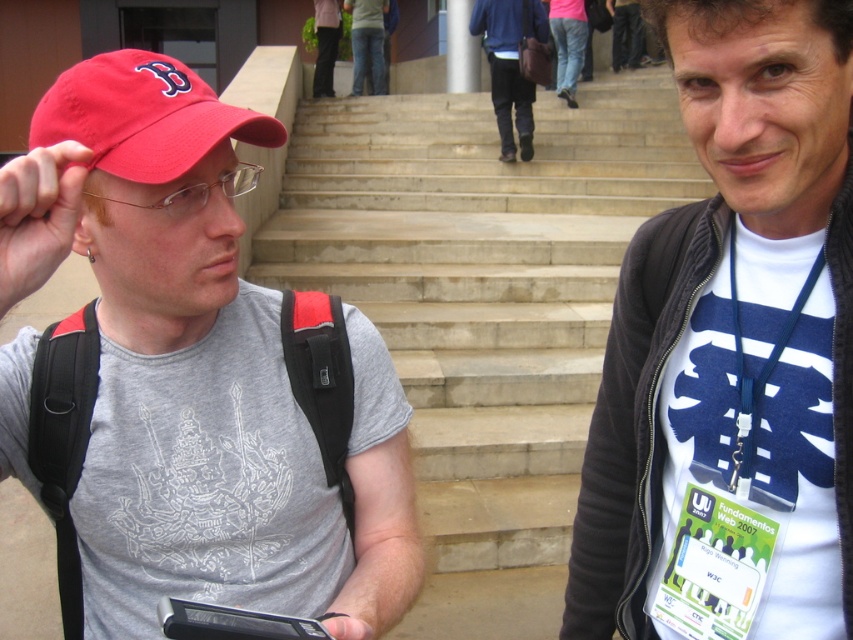
The image size is (853, 640). Identify the location of dark blue jeans at center. (509, 65).

Which is more to the left, dark blue jeans at center or black plastic smartphone at lower left?

Positioned to the left is black plastic smartphone at lower left.

Between point (469, 20) and point (248, 614), which one is positioned behind?

Positioned behind is point (469, 20).

I want to click on dark blue jeans at center, so click(509, 65).

Consider the image. Is white matte t-shirt at center thinner than matte red cap at upper left?

Correct, white matte t-shirt at center's width is less than matte red cap at upper left's.

Is white matte t-shirt at center above matte red cap at upper left?

Actually, white matte t-shirt at center is below matte red cap at upper left.

Between point (767, 324) and point (410, 528), which one is positioned behind?

Positioned behind is point (410, 528).

The image size is (853, 640). I want to click on white matte t-shirt at center, so click(x=732, y=352).

Is point (828, 337) closer to camera compared to point (495, 76)?

Yes.

Measure the distance between point (x=799, y=26) and camera.

They are 37.14 inches apart.

Image resolution: width=853 pixels, height=640 pixels. I want to click on white matte t-shirt at center, so click(732, 352).